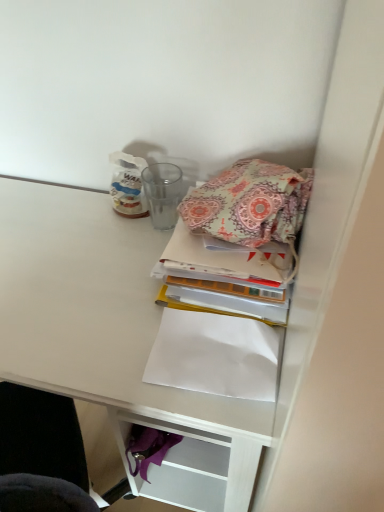
Question: Can you confirm if white matte desk at upper right is taller than paisley fabric book at center?

Choices:
 (A) yes
 (B) no

Answer: (A)

Question: Is white matte desk at upper right smaller than paisley fabric book at center?

Choices:
 (A) no
 (B) yes

Answer: (A)

Question: Is white matte desk at upper right further to the viewer compared to paisley fabric book at center?

Choices:
 (A) yes
 (B) no

Answer: (B)

Question: Is the position of white matte desk at upper right less distant than that of paisley fabric book at center?

Choices:
 (A) yes
 (B) no

Answer: (A)

Question: From a real-world perspective, does white matte desk at upper right stand above paisley fabric book at center?

Choices:
 (A) yes
 (B) no

Answer: (B)

Question: Relative to white paper at lower center, is white matte desk at upper right in front or behind?

Choices:
 (A) front
 (B) behind

Answer: (A)

Question: From a real-world perspective, is white matte desk at upper right above or below white paper at lower center?

Choices:
 (A) below
 (B) above

Answer: (A)

Question: Is white matte desk at upper right bigger or smaller than white paper at lower center?

Choices:
 (A) big
 (B) small

Answer: (A)

Question: Choose the correct answer: Is white matte desk at upper right inside white paper at lower center or outside it?

Choices:
 (A) inside
 (B) outside

Answer: (B)

Question: From a real-world perspective, relative to white paper at lower center, is paisley fabric book at center vertically above or below?

Choices:
 (A) below
 (B) above

Answer: (B)

Question: In terms of size, does paisley fabric book at center appear bigger or smaller than white paper at lower center?

Choices:
 (A) small
 (B) big

Answer: (B)

Question: Relative to white paper at lower center, is paisley fabric book at center in front or behind?

Choices:
 (A) behind
 (B) front

Answer: (A)

Question: Would you say paisley fabric book at center is to the left or to the right of white paper at lower center in the picture?

Choices:
 (A) left
 (B) right

Answer: (B)

Question: From the image's perspective, is white matte desk at upper right above or below paisley fabric book at center?

Choices:
 (A) above
 (B) below

Answer: (B)

Question: Would you say white matte desk at upper right is inside or outside paisley fabric book at center?

Choices:
 (A) outside
 (B) inside

Answer: (A)